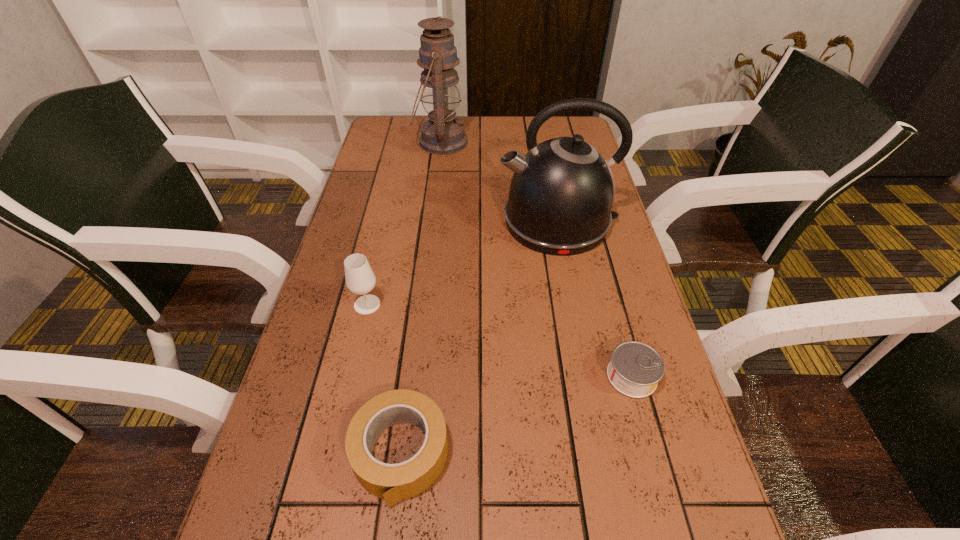
Locate an element on the screen. object that is positioned at the far left corner is located at coordinates (442, 134).

This screenshot has width=960, height=540. In order to click on vacant space at the left edge in this screenshot , I will do `click(371, 248)`.

In the image, there is a desktop. Where is `vacant space at the right edge`? The height and width of the screenshot is (540, 960). vacant space at the right edge is located at coordinates (620, 254).

The width and height of the screenshot is (960, 540). In order to click on vacant area at the far left corner in this screenshot , I will do `click(388, 116)`.

Find the location of a particular element. free space at the far right corner of the desktop is located at coordinates (551, 122).

The width and height of the screenshot is (960, 540). Identify the location of free space between the duct tape and the third shortest object. (384, 379).

Identify the location of unoccupied area between the kettle and the oil lamp. pos(499,182).

The height and width of the screenshot is (540, 960). Find the location of `free space between the kettle and the fourth tallest object`. free space between the kettle and the fourth tallest object is located at coordinates (479, 338).

Find the location of a particular element. free area in between the third shortest object and the second nearest object is located at coordinates (499, 340).

Locate an element on the screen. This screenshot has width=960, height=540. free area in between the kettle and the shortest object is located at coordinates (594, 299).